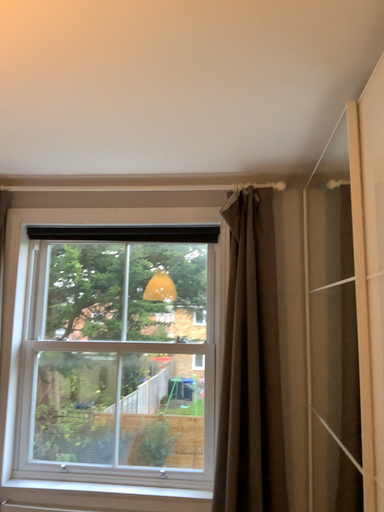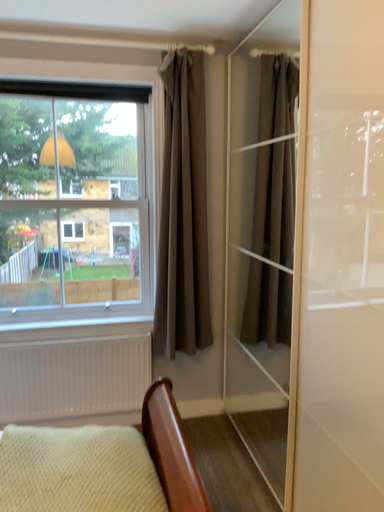
Question: Which way did the camera rotate in the video?

Choices:
 (A) rotated left
 (B) rotated right

Answer: (B)